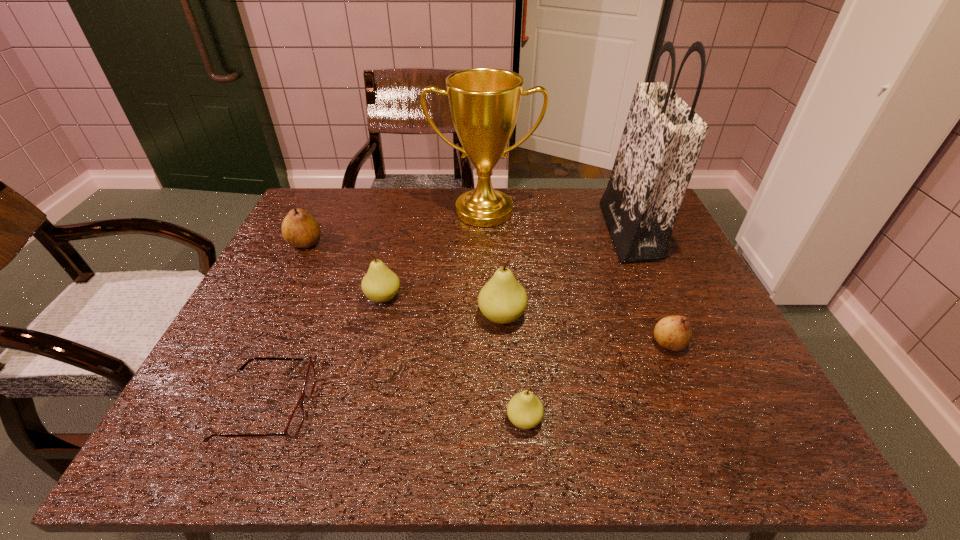
The image size is (960, 540). I want to click on vacant area at the near right corner of the desktop, so click(x=763, y=460).

The width and height of the screenshot is (960, 540). I want to click on vacant region between the spectacles and the nearest green pear, so click(396, 414).

The width and height of the screenshot is (960, 540). What are the coordinates of `vacant region between the fourth pear from right to left and the nearest green pear` in the screenshot? It's located at (454, 359).

The width and height of the screenshot is (960, 540). Find the location of `vacant area that lies between the fourth pear from right to left and the shortest object`. vacant area that lies between the fourth pear from right to left and the shortest object is located at coordinates (325, 352).

This screenshot has height=540, width=960. I want to click on free area in between the farther brown pear and the biggest green pear, so click(x=403, y=280).

The image size is (960, 540). Find the location of `vacant area that lies between the shopping bag and the nearer brown pear`. vacant area that lies between the shopping bag and the nearer brown pear is located at coordinates (649, 287).

What are the coordinates of `vacant region between the right brown pear and the fourth pear from right to left` in the screenshot? It's located at (526, 320).

You are a GUI agent. You are given a task and a screenshot of the screen. Output one action in this format:
    pyautogui.click(x=<x>, y=<y>)
    Task: Click on the vacant space that is in between the red spectacles and the right brown pear
    Image resolution: width=960 pixels, height=540 pixels.
    Given the screenshot: What is the action you would take?
    point(468,375)

Image resolution: width=960 pixels, height=540 pixels. I want to click on free area in between the nearest pear and the shortest object, so click(396, 414).

You are a GUI agent. You are given a task and a screenshot of the screen. Output one action in this format:
    pyautogui.click(x=<x>, y=<y>)
    Task: Click on the free space between the gold award and the sixth shortest object
    
    Given the screenshot: What is the action you would take?
    pyautogui.click(x=492, y=264)